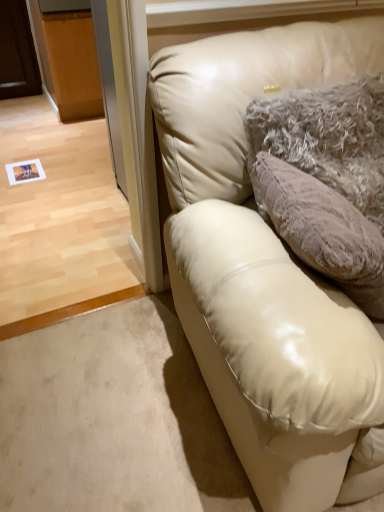
Question: From a real-world perspective, is fuzzy beige pillow at upper right under matte cream leather couch at upper right?

Choices:
 (A) no
 (B) yes

Answer: (A)

Question: Considering the relative sizes of fuzzy beige pillow at upper right and matte cream leather couch at upper right in the image provided, is fuzzy beige pillow at upper right shorter than matte cream leather couch at upper right?

Choices:
 (A) no
 (B) yes

Answer: (B)

Question: Can you confirm if fuzzy beige pillow at upper right is bigger than matte cream leather couch at upper right?

Choices:
 (A) yes
 (B) no

Answer: (B)

Question: Does fuzzy beige pillow at upper right come behind matte cream leather couch at upper right?

Choices:
 (A) no
 (B) yes

Answer: (B)

Question: Is fuzzy beige pillow at upper right directly adjacent to matte cream leather couch at upper right?

Choices:
 (A) yes
 (B) no

Answer: (B)

Question: Can you confirm if fuzzy beige pillow at upper right is positioned to the right of matte cream leather couch at upper right?

Choices:
 (A) yes
 (B) no

Answer: (B)

Question: Is matte cream leather couch at upper right wider than fuzzy beige pillow at upper right?

Choices:
 (A) yes
 (B) no

Answer: (A)

Question: Is matte cream leather couch at upper right to the right of fuzzy beige pillow at upper right from the viewer's perspective?

Choices:
 (A) yes
 (B) no

Answer: (A)

Question: Is the depth of matte cream leather couch at upper right less than that of fuzzy beige pillow at upper right?

Choices:
 (A) yes
 (B) no

Answer: (A)

Question: Does matte cream leather couch at upper right have a smaller size compared to fuzzy beige pillow at upper right?

Choices:
 (A) no
 (B) yes

Answer: (A)

Question: Does matte cream leather couch at upper right have a greater height compared to fuzzy beige pillow at upper right?

Choices:
 (A) yes
 (B) no

Answer: (A)

Question: Is matte cream leather couch at upper right turned away from fuzzy beige pillow at upper right?

Choices:
 (A) no
 (B) yes

Answer: (B)

Question: Is point (367, 166) closer or farther from the camera than point (309, 441)?

Choices:
 (A) closer
 (B) farther

Answer: (B)